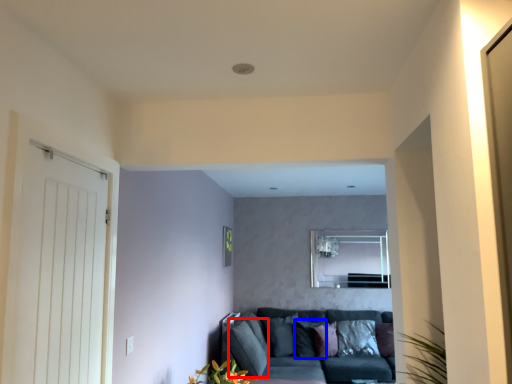
Question: Which object is closer to the camera taking this photo, pillow (highlighted by a red box) or pillow (highlighted by a blue box)?

Choices:
 (A) pillow
 (B) pillow

Answer: (A)